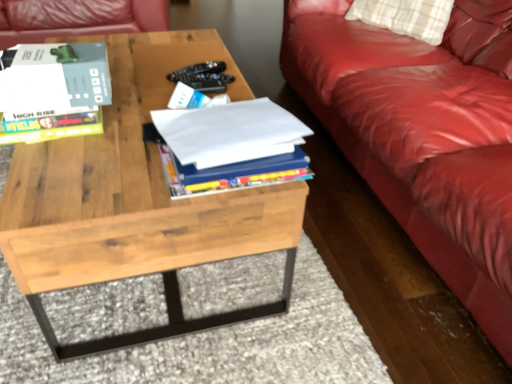
Question: Considering the relative sizes of matte gray book at upper left, arranged as the first book when viewed from the left, and natural wood coffee table at center in the image provided, is matte gray book at upper left, arranged as the first book when viewed from the left, shorter than natural wood coffee table at center?

Choices:
 (A) yes
 (B) no

Answer: (A)

Question: Can you confirm if matte gray book at upper left, which appears as the 2th book when viewed from the right, is taller than natural wood coffee table at center?

Choices:
 (A) yes
 (B) no

Answer: (B)

Question: From a real-world perspective, is matte gray book at upper left, which appears as the 2th book when viewed from the right, below natural wood coffee table at center?

Choices:
 (A) yes
 (B) no

Answer: (B)

Question: Is matte gray book at upper left, arranged as the first book when viewed from the left, facing away from natural wood coffee table at center?

Choices:
 (A) no
 (B) yes

Answer: (A)

Question: Is matte gray book at upper left, which appears as the 2th book when viewed from the right, aimed at natural wood coffee table at center?

Choices:
 (A) yes
 (B) no

Answer: (B)

Question: Is white paper at center, marked as the 2th book in a left-to-right arrangement, placed right next to matte gray book at upper left, which appears as the 2th book when viewed from the right?

Choices:
 (A) no
 (B) yes

Answer: (A)

Question: Considering the relative positions of white paper at center, marked as the 2th book in a left-to-right arrangement, and matte gray book at upper left, arranged as the first book when viewed from the left, in the image provided, is white paper at center, marked as the 2th book in a left-to-right arrangement, in front of matte gray book at upper left, arranged as the first book when viewed from the left,?

Choices:
 (A) yes
 (B) no

Answer: (A)

Question: From the image's perspective, does white paper at center, marked as the 2th book in a left-to-right arrangement, appear higher than matte gray book at upper left, arranged as the first book when viewed from the left?

Choices:
 (A) yes
 (B) no

Answer: (B)

Question: Considering the relative positions of white paper at center, marked as the 2th book in a left-to-right arrangement, and matte gray book at upper left, arranged as the first book when viewed from the left, in the image provided, is white paper at center, marked as the 2th book in a left-to-right arrangement, behind matte gray book at upper left, arranged as the first book when viewed from the left,?

Choices:
 (A) yes
 (B) no

Answer: (B)

Question: Is white paper at center, marked as the 2th book in a left-to-right arrangement, not near matte gray book at upper left, arranged as the first book when viewed from the left?

Choices:
 (A) no
 (B) yes

Answer: (A)

Question: Could matte gray book at upper left, which appears as the 2th book when viewed from the right, be considered to be inside white paper at center, marked as the 2th book in a left-to-right arrangement?

Choices:
 (A) yes
 (B) no

Answer: (B)

Question: Is white paper at center, marked as the 2th book in a left-to-right arrangement, positioned before natural wood coffee table at center?

Choices:
 (A) no
 (B) yes

Answer: (A)